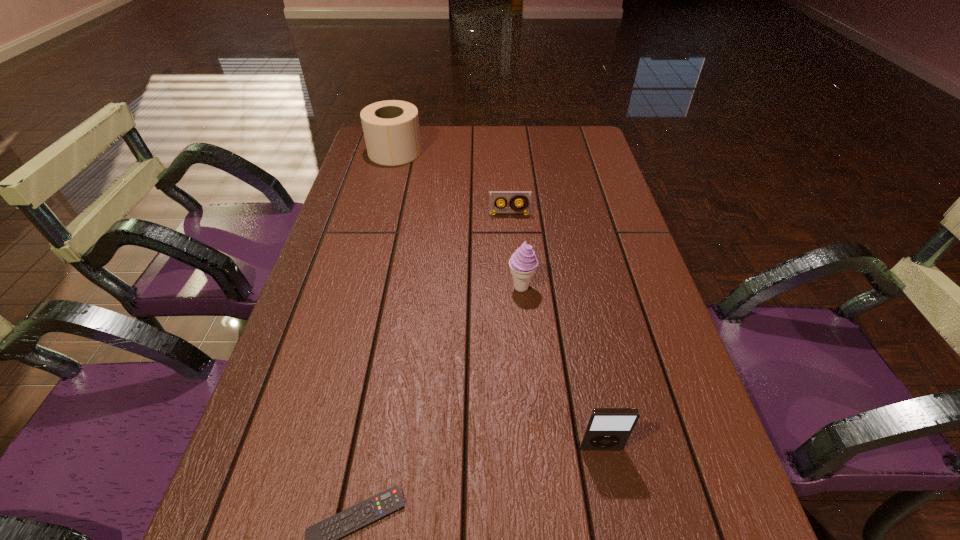
Locate an element on the screen. vacant space in between the fourth farthest object and the farthest object is located at coordinates (497, 300).

Find the location of a particular element. This screenshot has height=540, width=960. vacant area that lies between the iPod and the farthest object is located at coordinates (497, 300).

I want to click on the second closest object relative to the third nearest object, so click(606, 428).

Choose which object is the third nearest neighbor to the fourth tallest object. Please provide its 2D coordinates. Your answer should be formatted as a tuple, i.e. [(x, y)], where the tuple contains the x and y coordinates of a point satisfying the conditions above.

[(606, 428)]

Locate an element on the screen. The height and width of the screenshot is (540, 960). vacant space that satisfies the following two spatial constraints: 1. on the front side of the icecream; 2. on the left side of the toilet tissue is located at coordinates (358, 288).